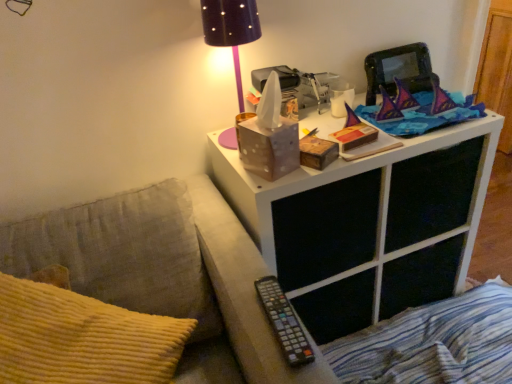
Question: Is black plastic remote at lower center next to blue striped fabric at lower right?

Choices:
 (A) no
 (B) yes

Answer: (A)

Question: Does black plastic remote at lower center appear on the left side of blue striped fabric at lower right?

Choices:
 (A) yes
 (B) no

Answer: (A)

Question: Does black plastic remote at lower center have a smaller size compared to blue striped fabric at lower right?

Choices:
 (A) no
 (B) yes

Answer: (B)

Question: Is the depth of black plastic remote at lower center greater than that of blue striped fabric at lower right?

Choices:
 (A) no
 (B) yes

Answer: (A)

Question: Can you confirm if black plastic remote at lower center is taller than blue striped fabric at lower right?

Choices:
 (A) no
 (B) yes

Answer: (A)

Question: Would you say black plastic remote at lower center is outside blue striped fabric at lower right?

Choices:
 (A) yes
 (B) no

Answer: (A)

Question: Can we say blue striped fabric at lower right lies outside black dotted fabric lampshade at upper center?

Choices:
 (A) no
 (B) yes

Answer: (B)

Question: Does blue striped fabric at lower right touch black dotted fabric lampshade at upper center?

Choices:
 (A) yes
 (B) no

Answer: (B)

Question: Is blue striped fabric at lower right turned away from black dotted fabric lampshade at upper center?

Choices:
 (A) yes
 (B) no

Answer: (B)

Question: Considering the relative sizes of blue striped fabric at lower right and black dotted fabric lampshade at upper center in the image provided, is blue striped fabric at lower right smaller than black dotted fabric lampshade at upper center?

Choices:
 (A) yes
 (B) no

Answer: (B)

Question: Is blue striped fabric at lower right in front of black dotted fabric lampshade at upper center?

Choices:
 (A) yes
 (B) no

Answer: (B)

Question: From the image's perspective, is blue striped fabric at lower right on black dotted fabric lampshade at upper center?

Choices:
 (A) yes
 (B) no

Answer: (B)

Question: Is black plastic remote at lower center in contact with white matte side table at upper right?

Choices:
 (A) yes
 (B) no

Answer: (B)